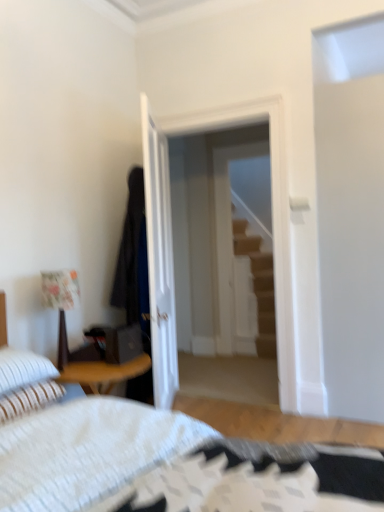
Looking at this image, how much space does white striped pillow at lower left, positioned as the first pillow in bottom-to-top order, occupy horizontally?

white striped pillow at lower left, positioned as the first pillow in bottom-to-top order, is 42.41 centimeters in width.

Image resolution: width=384 pixels, height=512 pixels. Describe the element at coordinates (133, 257) in the screenshot. I see `dark blue fabric robe at center` at that location.

What do you see at coordinates (259, 285) in the screenshot?
I see `wooden staircase at center` at bounding box center [259, 285].

The image size is (384, 512). What do you see at coordinates (273, 216) in the screenshot?
I see `transparent glass door at center` at bounding box center [273, 216].

The image size is (384, 512). Identify the location of white striped pillow at lower left, the first pillow viewed from the top. (23, 369).

Where is `floral fabric lampshade at left`? The width and height of the screenshot is (384, 512). floral fabric lampshade at left is located at coordinates (61, 303).

Who is smaller, dark blue fabric robe at center or white striped pillow at lower left, positioned as the first pillow in bottom-to-top order?

Smaller between the two is white striped pillow at lower left, positioned as the first pillow in bottom-to-top order.

From the image's perspective, is dark blue fabric robe at center located above or below white striped pillow at lower left, which is the 2th pillow from top to bottom?

Clearly, from the image's perspective, dark blue fabric robe at center is above white striped pillow at lower left, which is the 2th pillow from top to bottom.

Is dark blue fabric robe at center at the left side of white striped pillow at lower left, which is the 2th pillow from top to bottom?

No.

Is dark blue fabric robe at center turned away from white striped pillow at lower left, which is the 2th pillow from top to bottom?

No.

Consider the image. Between wooden staircase at center and transparent glass door at center, which one appears on the right side from the viewer's perspective?

Positioned to the right is wooden staircase at center.

From the image's perspective, between wooden staircase at center and transparent glass door at center, which one is located above?

wooden staircase at center is shown above in the image.

Is wooden staircase at center not inside transparent glass door at center?

wooden staircase at center lies outside transparent glass door at center's area.

How much distance is there between wooden staircase at center and transparent glass door at center?

wooden staircase at center and transparent glass door at center are 5.18 feet apart from each other.

Between point (150, 184) and point (21, 362), which one is positioned in front?

The point (21, 362) is in front.

Consider the image. Is white glossy door at center situated inside white striped pillow at lower left, the first pillow viewed from the top, or outside?

white glossy door at center is outside white striped pillow at lower left, the first pillow viewed from the top.

At what (x,y) coordinates should I click in order to perform the action: click on door above the white striped pillow at lower left, which appears as the second pillow when ordered from the bottom (from a real-world perspective). Please return your answer as a coordinate pair (x, y). Looking at the image, I should click on (159, 259).

Considering the sizes of objects white glossy door at center and white striped pillow at lower left, the first pillow viewed from the top, in the image provided, who is taller, white glossy door at center or white striped pillow at lower left, the first pillow viewed from the top,?

With more height is white glossy door at center.

From a real-world perspective, which object stands above the other?

From a 3D spatial view, dark blue fabric robe at center is above.

Which point is more forward, (76, 295) or (142, 170)?

Point (76, 295)

You are a GUI agent. You are given a task and a screenshot of the screen. Output one action in this format:
    pyautogui.click(x=<x>, y=<y>)
    Task: Click on the lamp below the dark blue fabric robe at center (from a real-world perspective)
    
    Given the screenshot: What is the action you would take?
    pyautogui.click(x=61, y=303)

Would you say dark blue fabric robe at center is part of floral fabric lampshade at left's contents?

No, dark blue fabric robe at center is not inside floral fabric lampshade at left.

Between white textured bed at lower left and wooden staircase at center, which one has less height?

With less height is white textured bed at lower left.

From a real-world perspective, does white textured bed at lower left sit lower than wooden staircase at center?

Yes, from a real-world perspective, white textured bed at lower left is beneath wooden staircase at center.

What are the coordinates of `bed that appears on the left of wooden staircase at center` in the screenshot? It's located at (170, 465).

Can we say wooden staircase at center lies outside white glossy door at center?

wooden staircase at center is positioned outside white glossy door at center.

Consider the image. Does wooden staircase at center have a larger size compared to white glossy door at center?

Actually, wooden staircase at center might be smaller than white glossy door at center.

Looking at this image, from the image's perspective, is wooden staircase at center above white glossy door at center?

Correct, wooden staircase at center appears higher than white glossy door at center in the image.

Considering their positions, is wooden staircase at center located in front of or behind white glossy door at center?

wooden staircase at center is behind white glossy door at center.

Who is more distant, white striped pillow at lower left, the first pillow viewed from the top, or wooden staircase at center?

wooden staircase at center is behind.

Locate an element on the screen. the 1st pillow positioned below the wooden staircase at center (from a real-world perspective) is located at coordinates (23, 369).

Which of these two, white striped pillow at lower left, which appears as the second pillow when ordered from the bottom, or wooden staircase at center, is wider?

Wider between the two is white striped pillow at lower left, which appears as the second pillow when ordered from the bottom.

From a real-world perspective, relative to wooden staircase at center, is white striped pillow at lower left, the first pillow viewed from the top, vertically above or below?

white striped pillow at lower left, the first pillow viewed from the top, is below wooden staircase at center.

Image resolution: width=384 pixels, height=512 pixels. Identify the location of the 2nd pillow directly beneath the dark blue fabric robe at center (from a real-world perspective). (29, 399).

Where is `stairs on the right of transparent glass door at center`? stairs on the right of transparent glass door at center is located at coordinates (259, 285).

Consider the image. Estimate the real-world distances between objects in this image. Which object is further from white striped pillow at lower left, which appears as the second pillow when ordered from the bottom, transparent glass door at center or floral fabric lampshade at left?

transparent glass door at center lies further to white striped pillow at lower left, which appears as the second pillow when ordered from the bottom, than the other object.

Estimate the real-world distances between objects in this image. Which object is further from white striped pillow at lower left, which is the 2th pillow from top to bottom, dark blue fabric robe at center or floral fabric lampshade at left?

dark blue fabric robe at center is positioned further to the anchor white striped pillow at lower left, which is the 2th pillow from top to bottom.

Looking at the image, which one is located closer to white glossy door at center, floral fabric lampshade at left or dark blue fabric robe at center?

Based on the image, dark blue fabric robe at center appears to be nearer to white glossy door at center.

Looking at the image, which one is located closer to white striped pillow at lower left, the first pillow viewed from the top, transparent glass door at center or white textured bed at lower left?

white textured bed at lower left lies closer to white striped pillow at lower left, the first pillow viewed from the top, than the other object.

Estimate the real-world distances between objects in this image. Which object is further from wooden staircase at center, floral fabric lampshade at left or dark blue fabric robe at center?

floral fabric lampshade at left is positioned further to the anchor wooden staircase at center.

Which object lies further to the anchor point dark blue fabric robe at center, white striped pillow at lower left, positioned as the first pillow in bottom-to-top order, or floral fabric lampshade at left?

white striped pillow at lower left, positioned as the first pillow in bottom-to-top order.

Estimate the real-world distances between objects in this image. Which object is closer to white glossy door at center, white striped pillow at lower left, the first pillow viewed from the top, or white striped pillow at lower left, positioned as the first pillow in bottom-to-top order?

The object closer to white glossy door at center is white striped pillow at lower left, the first pillow viewed from the top.

From the image, which object appears to be farther from white striped pillow at lower left, which appears as the second pillow when ordered from the bottom, dark blue fabric robe at center or wooden staircase at center?

wooden staircase at center is further to white striped pillow at lower left, which appears as the second pillow when ordered from the bottom.

Locate an element on the screen. The image size is (384, 512). door positioned between white textured bed at lower left and wooden staircase at center from near to far is located at coordinates (159, 259).

This screenshot has width=384, height=512. In order to click on pillow between white striped pillow at lower left, which is the 2th pillow from top to bottom, and white glossy door at center, along the z-axis in this screenshot , I will do `click(23, 369)`.

At what (x,y) coordinates should I click in order to perform the action: click on door positioned between white striped pillow at lower left, positioned as the first pillow in bottom-to-top order, and transparent glass door at center from near to far. Please return your answer as a coordinate pair (x, y). The image size is (384, 512). Looking at the image, I should click on (159, 259).

The image size is (384, 512). Identify the location of lamp between white striped pillow at lower left, the first pillow viewed from the top, and transparent glass door at center from front to back. (61, 303).